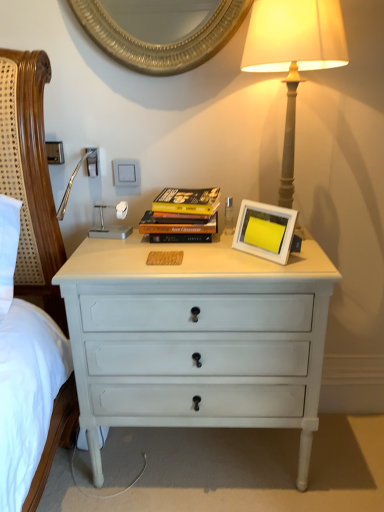
Locate an element on the screen. free space that is to the left of hardcover books at center is located at coordinates (116, 241).